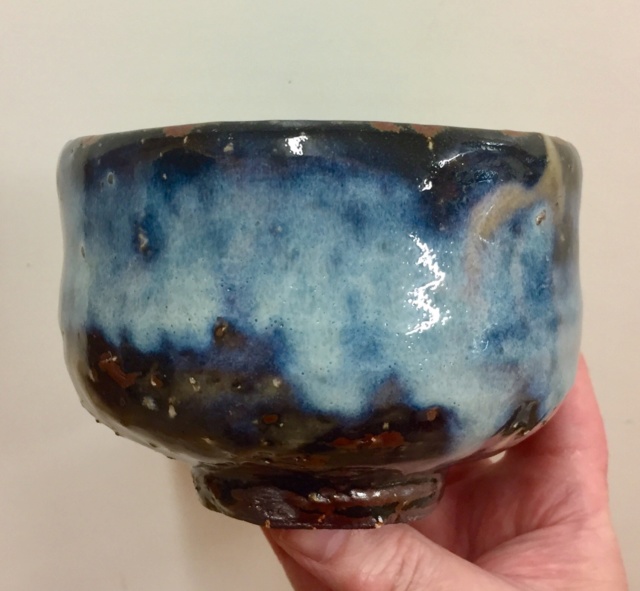
This screenshot has width=640, height=591. I want to click on wall, so click(523, 73).